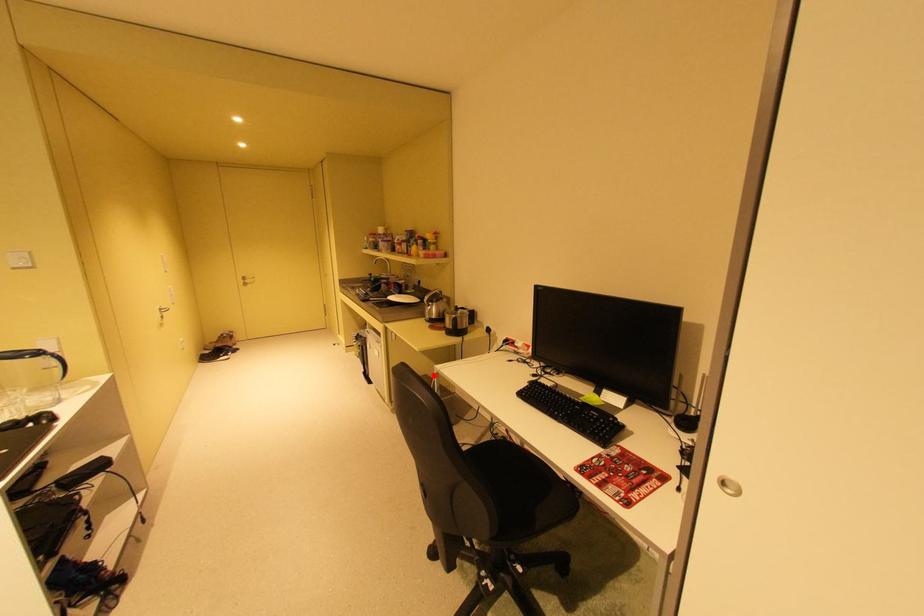
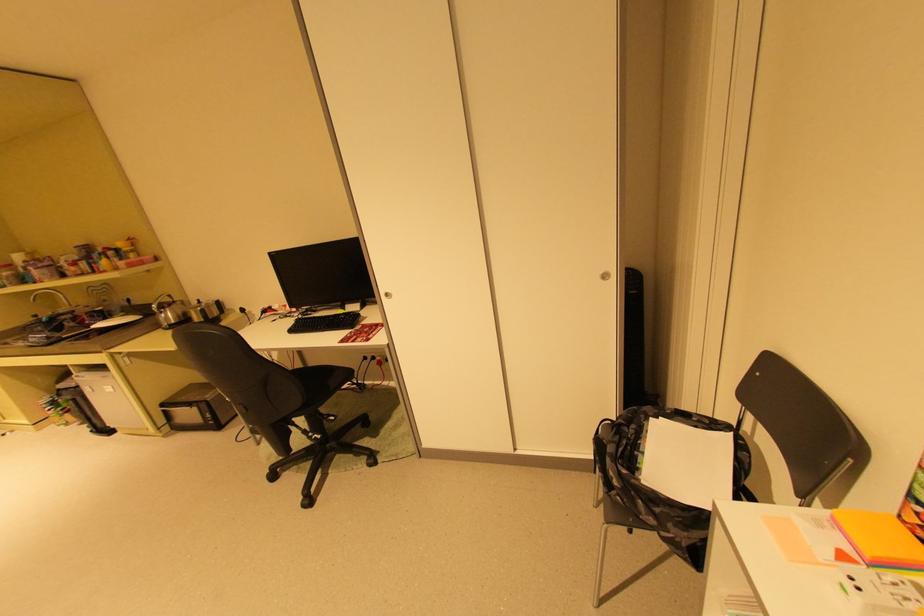
In the second image, find the point that corresponds to the highlighted location in the first image.

(199, 385)